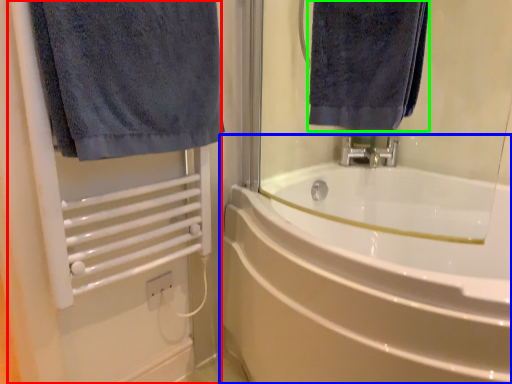
Question: Considering the real-world distances, which object is closest to screen door (highlighted by a red box)? bathtub (highlighted by a blue box) or towel (highlighted by a green box).

Choices:
 (A) bathtub
 (B) towel

Answer: (A)